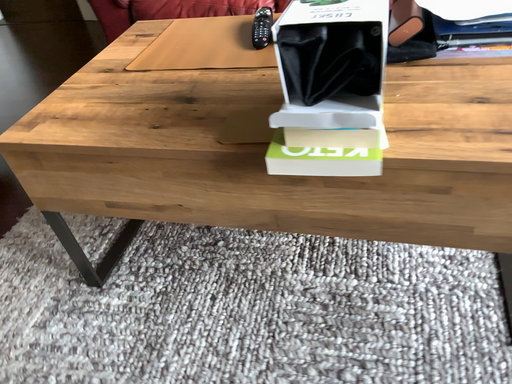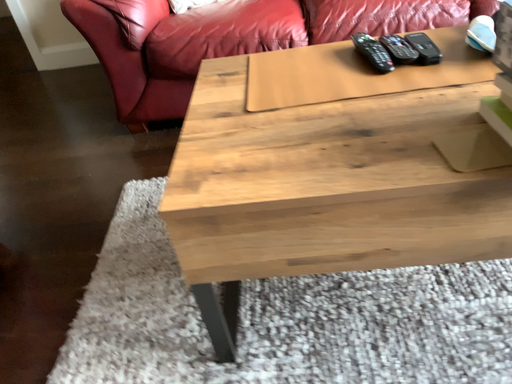
Question: How did the camera likely rotate when shooting the video?

Choices:
 (A) rotated right
 (B) rotated left

Answer: (A)